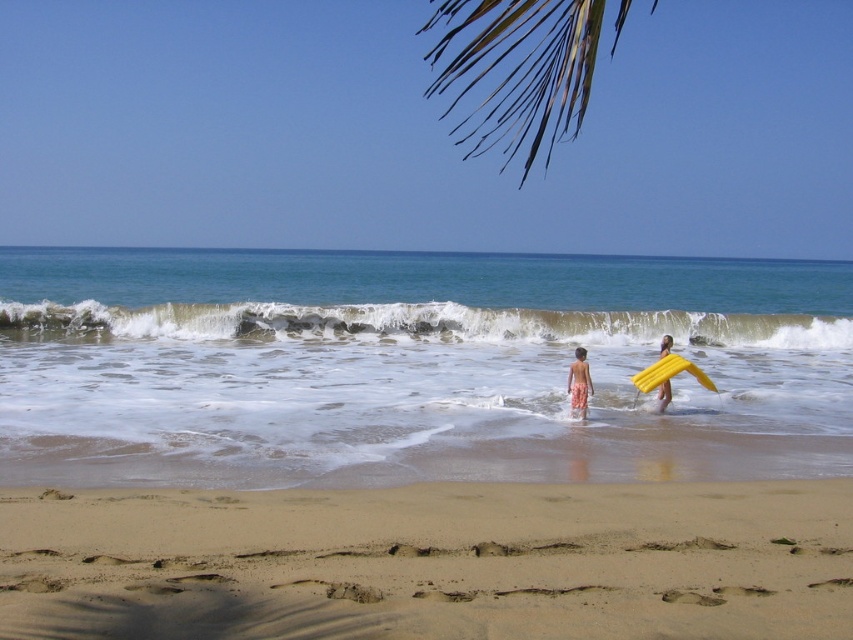
Is clear blue water at center thinner than yellow foam surfboard at lower right?

In fact, clear blue water at center might be wider than yellow foam surfboard at lower right.

Based on the photo, who is higher up, clear blue water at center or yellow foam surfboard at lower right?

clear blue water at center is above.

Does point (268, 346) come behind point (660, 412)?

Yes, point (268, 346) is farther from viewer.

Locate an element on the screen. The width and height of the screenshot is (853, 640). clear blue water at center is located at coordinates (412, 365).

Between fine-grained sand at lower center and white foam wave at center, which one appears on the left side from the viewer's perspective?

fine-grained sand at lower center is more to the left.

Who is more distant from viewer, (281, 602) or (312, 340)?

The point (312, 340) is behind.

Between point (306, 506) and point (160, 326), which one is positioned in front?

Point (306, 506) is more forward.

This screenshot has height=640, width=853. What are the coordinates of `fine-grained sand at lower center` in the screenshot? It's located at (430, 563).

Between fine-grained sand at lower center and yellow foam surfboard at lower right, which one has more height?

yellow foam surfboard at lower right

Between fine-grained sand at lower center and yellow foam surfboard at lower right, which one has less height?

With less height is fine-grained sand at lower center.

Is point (683, 589) positioned in front of point (660, 403)?

That is True.

I want to click on fine-grained sand at lower center, so click(430, 563).